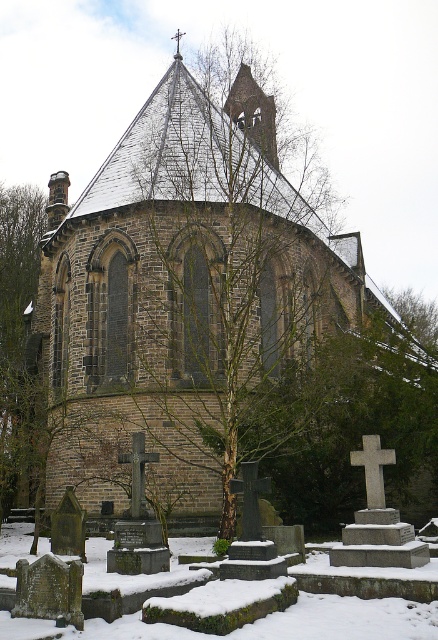
Question: From the image, what is the correct spatial relationship of brown stone church at center in relation to white frosty snow at lower center?

Choices:
 (A) left
 (B) right

Answer: (B)

Question: Which point is closer to the camera?

Choices:
 (A) (240, 628)
 (B) (166, 227)

Answer: (A)

Question: Does brown stone church at center have a larger size compared to white frosty snow at lower center?

Choices:
 (A) yes
 (B) no

Answer: (A)

Question: Is the position of brown stone church at center less distant than that of white frosty snow at lower center?

Choices:
 (A) no
 (B) yes

Answer: (A)